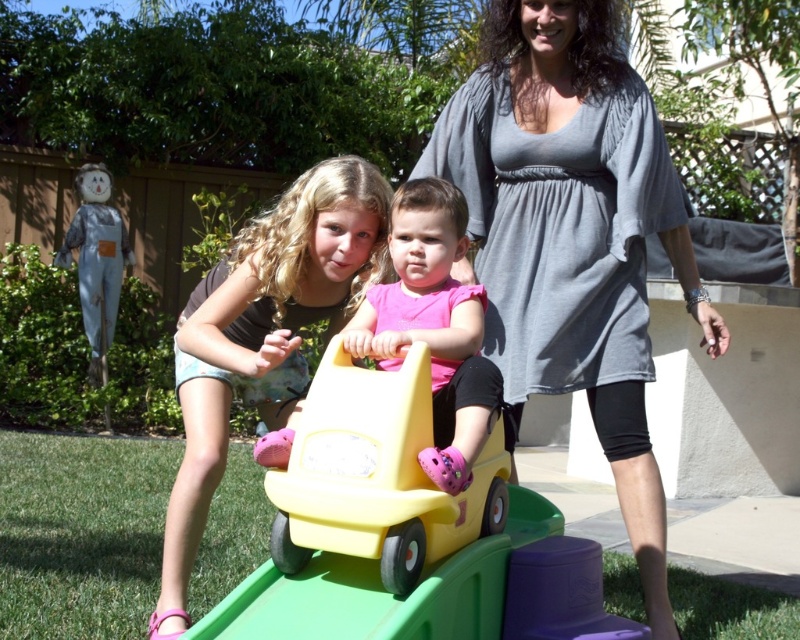
Is matte pink shorts at center taller than pink matte car seat at center?

Yes.

Who is more forward, (198, 419) or (456, 209)?

Point (456, 209) is more forward.

Measure the distance between point (190, 326) and camera.

8.86 feet

In order to click on matte pink shorts at center in this screenshot , I will do `click(264, 336)`.

Is yellow plastic car at center above pink matte car seat at center?

Actually, yellow plastic car at center is below pink matte car seat at center.

Is point (322, 396) closer to viewer compared to point (400, 326)?

Yes.

This screenshot has height=640, width=800. Find the location of `yellow plastic car at center`. yellow plastic car at center is located at coordinates (396, 529).

Does gray cotton dress at center have a greater width compared to yellow plastic car at center?

Incorrect, gray cotton dress at center's width does not surpass yellow plastic car at center's.

Is point (612, 157) farther from camera compared to point (364, 392)?

Yes, it is behind point (364, 392).

Is point (448, 136) positioned behind point (366, 394)?

Yes, it is.

At what (x,y) coordinates should I click in order to perform the action: click on gray cotton dress at center. Please return your answer as a coordinate pair (x, y). Looking at the image, I should click on (572, 236).